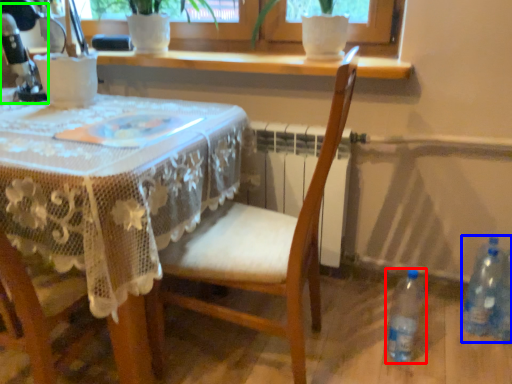
Question: Which is farther away from bottle (highlighted by a red box)? bottle (highlighted by a blue box) or sewing machine (highlighted by a green box)?

Choices:
 (A) bottle
 (B) sewing machine

Answer: (B)